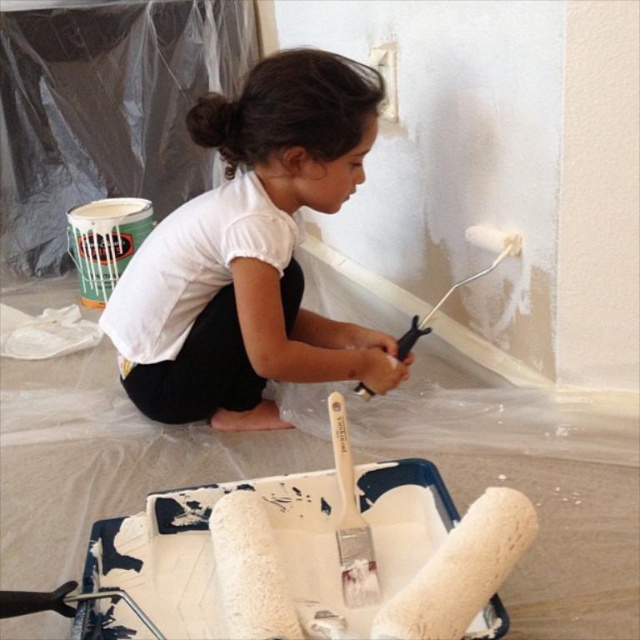
Question: Is white matte shirt at center smaller than white matte paint roller at upper center?

Choices:
 (A) yes
 (B) no

Answer: (B)

Question: Does white matte shirt at center lie in front of white matte paint roller at upper center?

Choices:
 (A) yes
 (B) no

Answer: (A)

Question: Does white matte shirt at center lie in front of white matte paint roller at upper center?

Choices:
 (A) no
 (B) yes

Answer: (B)

Question: Which object is farther from the camera taking this photo?

Choices:
 (A) white matte shirt at center
 (B) white matte paint roller at upper center

Answer: (B)